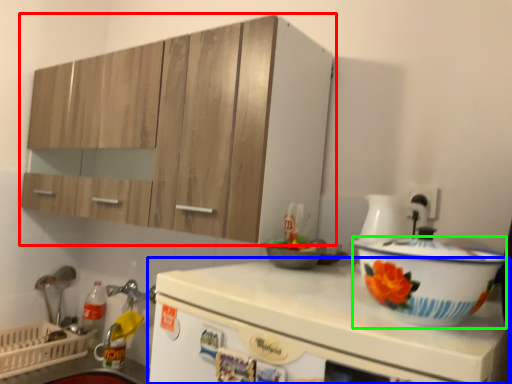
Question: Estimate the real-world distances between objects in this image. Which object is farther from cabinetry (highlighted by a red box), countertop (highlighted by a blue box) or basin (highlighted by a green box)?

Choices:
 (A) countertop
 (B) basin

Answer: (B)